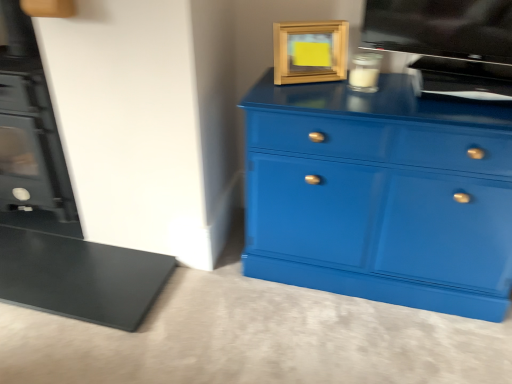
Question: Does clear glass candle at upper center, placed as the first appliance when sorted from left to right, have a greater width compared to flat screen tv at upper right, placed as the 2th appliance when sorted from left to right?

Choices:
 (A) yes
 (B) no

Answer: (A)

Question: Could flat screen tv at upper right, the 1th appliance when ordered from right to left, be considered to be inside clear glass candle at upper center, placed as the first appliance when sorted from left to right?

Choices:
 (A) yes
 (B) no

Answer: (B)

Question: Can you confirm if clear glass candle at upper center, which appears as the second appliance when viewed from the right, is thinner than flat screen tv at upper right, the 1th appliance when ordered from right to left?

Choices:
 (A) no
 (B) yes

Answer: (A)

Question: Does clear glass candle at upper center, placed as the first appliance when sorted from left to right, come behind flat screen tv at upper right, placed as the 2th appliance when sorted from left to right?

Choices:
 (A) no
 (B) yes

Answer: (B)

Question: Is flat screen tv at upper right, placed as the 2th appliance when sorted from left to right, at the back of clear glass candle at upper center, which appears as the second appliance when viewed from the right?

Choices:
 (A) no
 (B) yes

Answer: (B)

Question: Are clear glass candle at upper center, placed as the first appliance when sorted from left to right, and flat screen tv at upper right, placed as the 2th appliance when sorted from left to right, beside each other?

Choices:
 (A) yes
 (B) no

Answer: (B)

Question: From a real-world perspective, is wooden picture frame at upper center physically above clear glass candle at upper center, which appears as the second appliance when viewed from the right?

Choices:
 (A) yes
 (B) no

Answer: (A)

Question: Would you say wooden picture frame at upper center is outside clear glass candle at upper center, which appears as the second appliance when viewed from the right?

Choices:
 (A) yes
 (B) no

Answer: (A)

Question: Does wooden picture frame at upper center have a lesser height compared to clear glass candle at upper center, placed as the first appliance when sorted from left to right?

Choices:
 (A) yes
 (B) no

Answer: (B)

Question: Is wooden picture frame at upper center not close to clear glass candle at upper center, which appears as the second appliance when viewed from the right?

Choices:
 (A) yes
 (B) no

Answer: (B)

Question: Could you tell me if wooden picture frame at upper center is turned towards clear glass candle at upper center, placed as the first appliance when sorted from left to right?

Choices:
 (A) yes
 (B) no

Answer: (B)

Question: From a real-world perspective, is wooden picture frame at upper center below clear glass candle at upper center, which appears as the second appliance when viewed from the right?

Choices:
 (A) yes
 (B) no

Answer: (B)

Question: Considering the relative sizes of clear glass candle at upper center, placed as the first appliance when sorted from left to right, and wooden picture frame at upper center in the image provided, is clear glass candle at upper center, placed as the first appliance when sorted from left to right, smaller than wooden picture frame at upper center?

Choices:
 (A) yes
 (B) no

Answer: (A)